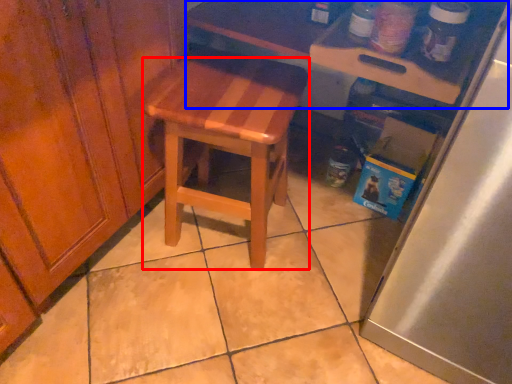
Question: Which of the following is the farthest to the observer, stool (highlighted by a red box) or table (highlighted by a blue box)?

Choices:
 (A) stool
 (B) table

Answer: (A)